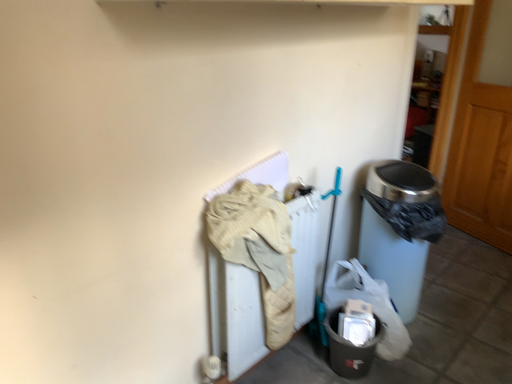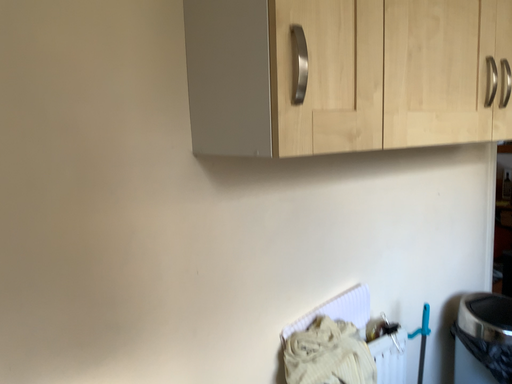
Question: Which way did the camera rotate in the video?

Choices:
 (A) rotated downward
 (B) rotated upward

Answer: (B)